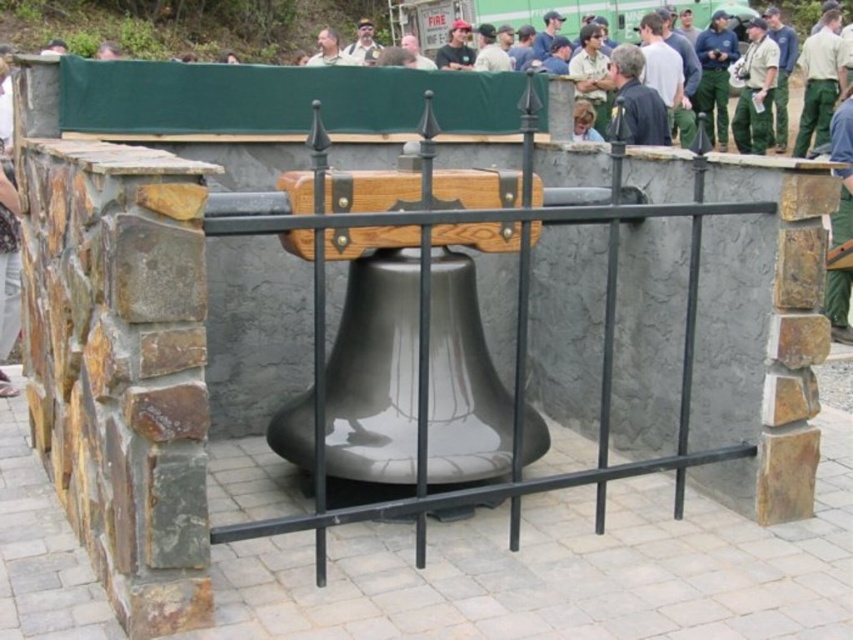
Can you confirm if green uniform pants at upper right is bigger than light brown leather jacket at center?

Indeed, green uniform pants at upper right has a larger size compared to light brown leather jacket at center.

Is point (804, 93) positioned after point (592, 120)?

That is True.

Locate an element on the screen. This screenshot has width=853, height=640. green uniform pants at upper right is located at coordinates (820, 81).

Does green uniform pants at upper right come behind green uniform at upper right?

No, it is in front of green uniform at upper right.

What do you see at coordinates (820, 81) in the screenshot? I see `green uniform pants at upper right` at bounding box center [820, 81].

Locate an element on the screen. Image resolution: width=853 pixels, height=640 pixels. green uniform pants at upper right is located at coordinates (820, 81).

Can you confirm if green uniform at upper right is taller than light brown leather jacket at center?

Yes, green uniform at upper right is taller than light brown leather jacket at center.

Is green uniform at upper right shorter than light brown leather jacket at center?

Incorrect, green uniform at upper right's height does not fall short of light brown leather jacket at center's.

At what (x,y) coordinates should I click in order to perform the action: click on green uniform at upper right. Please return your answer as a coordinate pair (x, y). The width and height of the screenshot is (853, 640). Looking at the image, I should click on (755, 90).